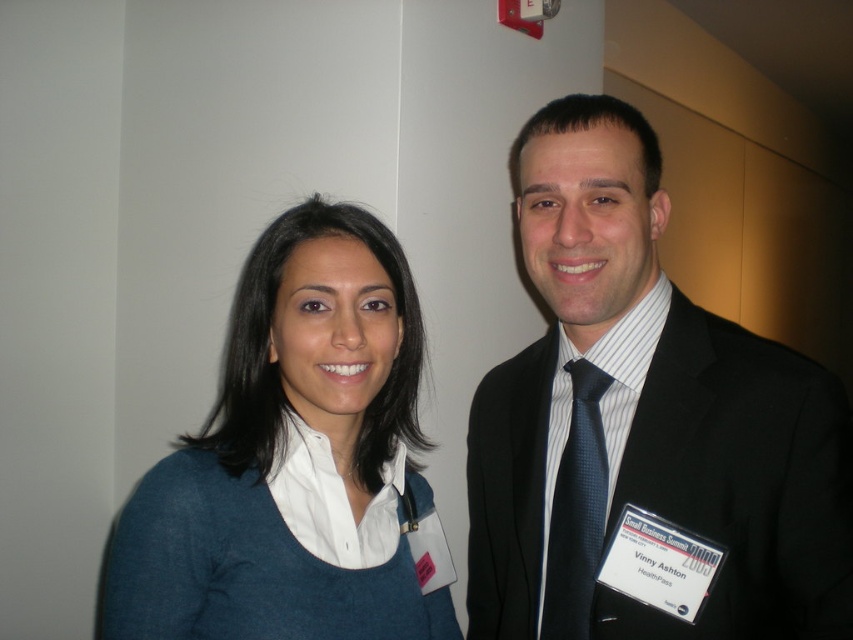
Does blue fabric shirt at left have a lesser width compared to black textured tie at right?

In fact, blue fabric shirt at left might be wider than black textured tie at right.

Who is higher up, blue fabric shirt at left or black textured tie at right?

blue fabric shirt at left

Find the location of a particular element. The image size is (853, 640). blue fabric shirt at left is located at coordinates (293, 460).

The image size is (853, 640). What are the coordinates of `blue fabric shirt at left` in the screenshot? It's located at (293, 460).

Is black suit at center further to the viewer compared to black textured tie at right?

No, it is in front of black textured tie at right.

Based on the photo, between black suit at center and black textured tie at right, which one has less height?

black textured tie at right

Does point (567, 500) come behind point (583, 428)?

No.

Find the location of a particular element. The height and width of the screenshot is (640, 853). black suit at center is located at coordinates (643, 419).

Is black suit at center bigger than blue fabric shirt at left?

Yes, black suit at center is bigger than blue fabric shirt at left.

Image resolution: width=853 pixels, height=640 pixels. Identify the location of black suit at center. (643, 419).

Is point (825, 568) behind point (343, 298)?

No.

Find the location of a particular element. black suit at center is located at coordinates (643, 419).